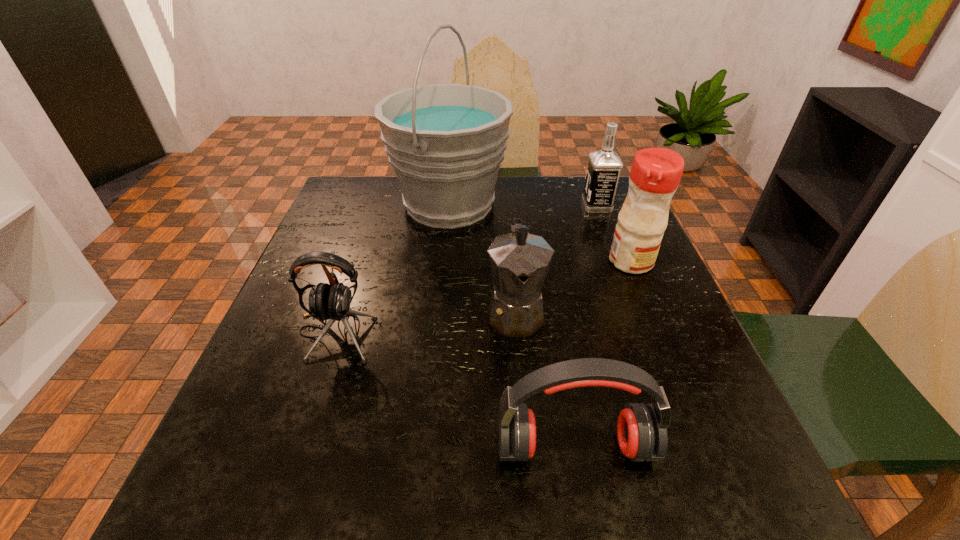
Identify the location of condiment located in the right edge section of the desktop. The width and height of the screenshot is (960, 540). (655, 174).

Where is `vodka situated at the right edge`? This screenshot has width=960, height=540. vodka situated at the right edge is located at coordinates (604, 166).

Find the location of a particular element. The image size is (960, 540). earphone that is positioned at the right edge is located at coordinates (641, 428).

What are the coordinates of `object present at the far left corner` in the screenshot? It's located at (445, 142).

Find the location of `object present at the far right corner`. object present at the far right corner is located at coordinates click(604, 166).

Locate an element on the screen. object that is at the near right corner is located at coordinates tap(641, 428).

The height and width of the screenshot is (540, 960). In order to click on vacant space at the left edge of the desktop in this screenshot , I will do `click(291, 454)`.

The image size is (960, 540). Identify the location of free region at the right edge of the desktop. (635, 395).

The height and width of the screenshot is (540, 960). I want to click on vacant area at the far left corner of the desktop, so click(381, 200).

In the image, there is a desktop. Where is `vacant space at the far right corner`? vacant space at the far right corner is located at coordinates (613, 212).